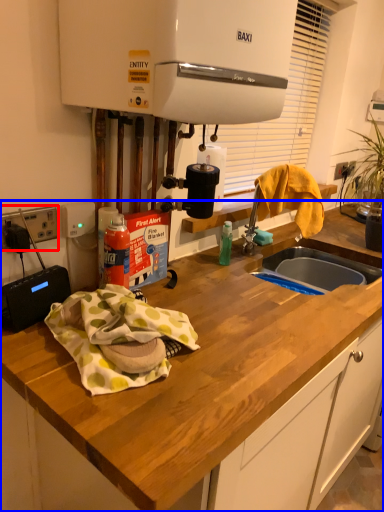
Question: Which point is closer to the camera, electric outlet (highlighted by a red box) or countertop (highlighted by a blue box)?

Choices:
 (A) electric outlet
 (B) countertop

Answer: (B)